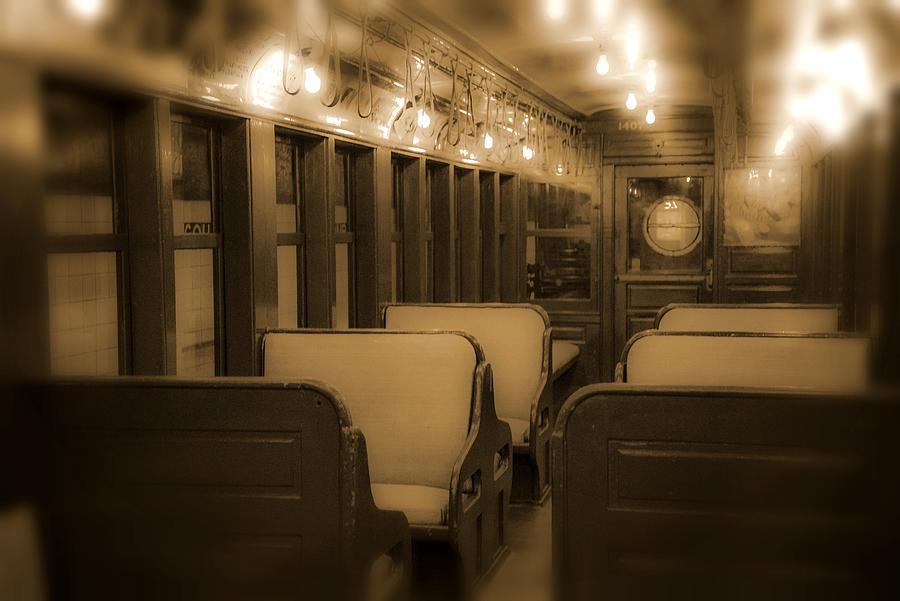
The height and width of the screenshot is (601, 900). Identify the location of chipped paint. (346, 445).